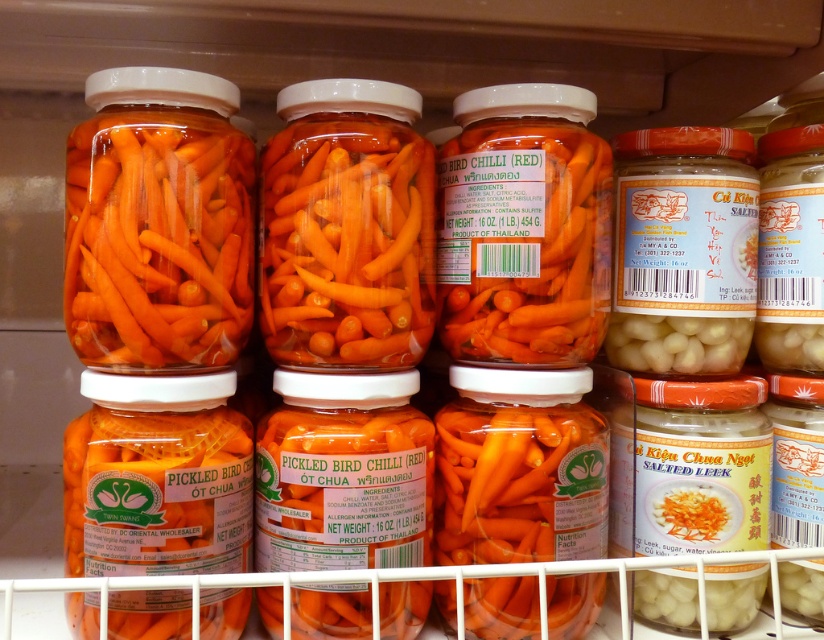
Is orange glossy pickled carrots at center to the right of translucent glass jar of pickled bird chilli at center from the viewer's perspective?

In fact, orange glossy pickled carrots at center is to the left of translucent glass jar of pickled bird chilli at center.

Can you confirm if orange glossy pickled carrots at center is bigger than translucent glass jar of pickled bird chilli at center?

No.

Is point (206, 211) farther from camera compared to point (560, 557)?

No, it is not.

Locate an element on the screen. orange glossy pickled carrots at center is located at coordinates (158, 244).

Which is more to the left, orange glossy pickled bird chilli at center or translucent glass jar of salted leek at center?

From the viewer's perspective, orange glossy pickled bird chilli at center appears more on the left side.

Who is lower down, orange glossy pickled bird chilli at center or translucent glass jar of salted leek at center?

Positioned lower is translucent glass jar of salted leek at center.

Between point (354, 129) and point (762, 518), which one is positioned in front?

Positioned in front is point (354, 129).

The width and height of the screenshot is (824, 640). Find the location of `orange glossy pickled bird chilli at center`. orange glossy pickled bird chilli at center is located at coordinates pos(345,243).

Is orange glossy pickled carrots at center to the right of white matte glass jar at right from the viewer's perspective?

Incorrect, orange glossy pickled carrots at center is not on the right side of white matte glass jar at right.

Between orange glossy pickled carrots at center and white matte glass jar at right, which one has less height?

With less height is orange glossy pickled carrots at center.

Which is behind, point (158, 224) or point (731, 214)?

The point (731, 214) is more distant.

Find the location of a particular element. This screenshot has width=824, height=640. orange glossy pickled carrots at center is located at coordinates pos(158,244).